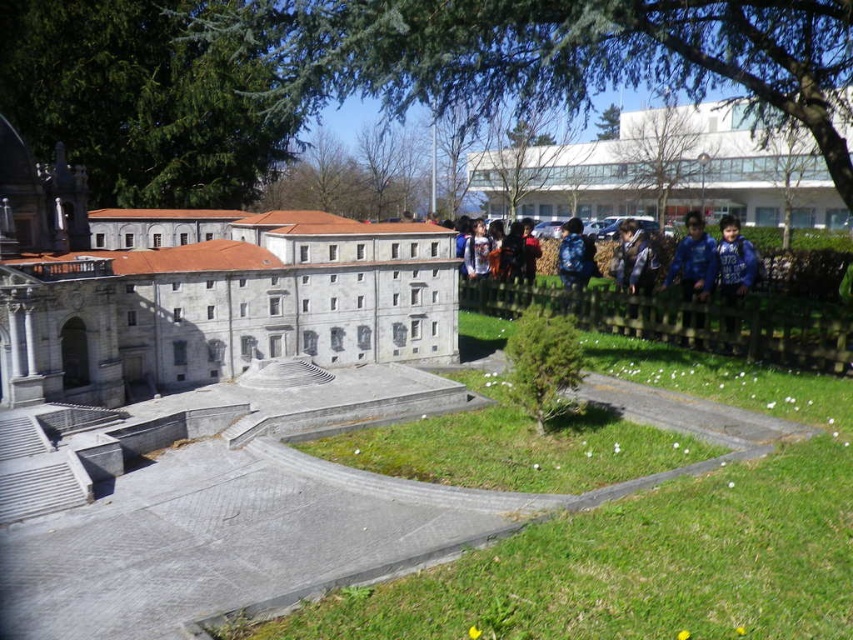
You are a photographer standing in front of the grand building. You notice a blue fabric shirt at right and a blue backpack at center in the scene. Which object is closer to you, the photographer?

The blue fabric shirt at right is closer to you because it is in front of the blue backpack at center.

You are a delivery drone with a wingspan of 1.2 meters. You need to fly from the white glass building at center to the blue fabric shirt at right. Is there enough space for you to pass through the area between them?

The distance between the white glass building at center and the blue fabric shirt at right is 9.16 meters. Since your wingspan is only 1.2 meters, there is ample space for you to pass through the area between them.

You are standing in front of the miniature model of the grand building. You notice a blue fabric shirt at right. Can you determine its exact location using the coordinate system provided?

The blue fabric shirt at right is located at point (x=733, y=262), so it is positioned at that coordinate in the image.